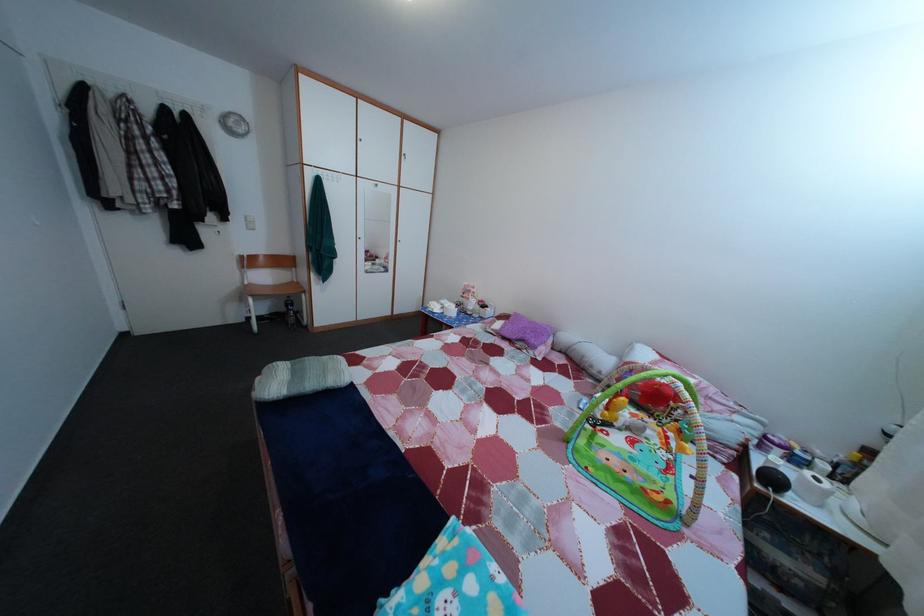
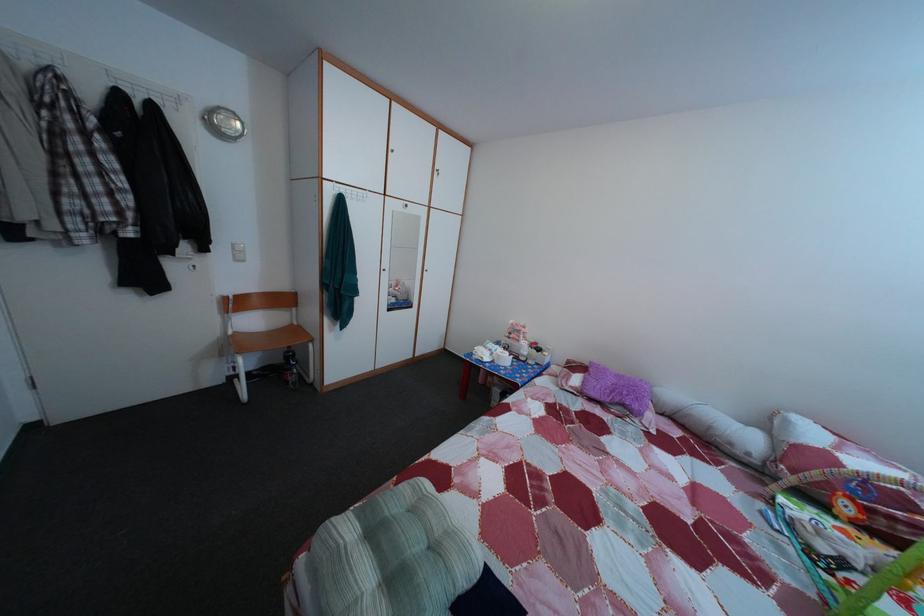
In the second image, find the point that corresponds to point (531, 351) in the first image.

(628, 416)